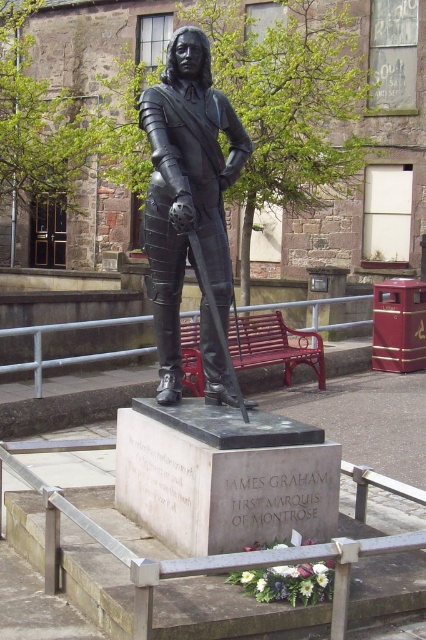
Who is higher up, bronze armor at center or metallic red bench at center?

Positioned higher is bronze armor at center.

From the picture: Which is more to the left, bronze armor at center or metallic red bench at center?

From the viewer's perspective, bronze armor at center appears more on the left side.

The image size is (426, 640). Find the location of `bronze armor at center`. bronze armor at center is located at coordinates (187, 189).